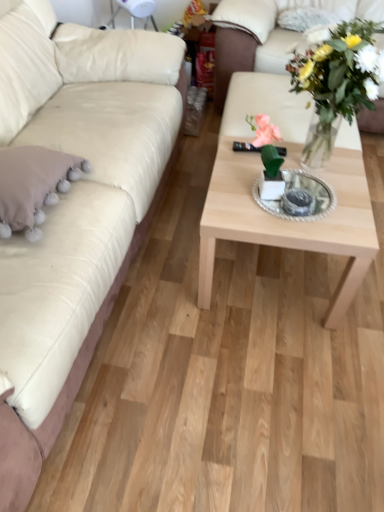
Question: From a real-world perspective, is matte white couch at left, the 2th studio couch when ordered from right to left, beneath beige fabric pillow at left, which appears as the 2th pillow when viewed from the back?

Choices:
 (A) yes
 (B) no

Answer: (A)

Question: Does matte white couch at left, the 2th studio couch when ordered from right to left, have a greater width compared to beige fabric pillow at left, the second pillow positioned from the top?

Choices:
 (A) no
 (B) yes

Answer: (B)

Question: Is matte white couch at left, which ranks as the first studio couch in left-to-right order, bigger than beige fabric pillow at left, the second pillow positioned from the top?

Choices:
 (A) yes
 (B) no

Answer: (A)

Question: Does matte white couch at left, the 2th studio couch when ordered from right to left, have a lesser height compared to beige fabric pillow at left, marked as the first pillow in a front-to-back arrangement?

Choices:
 (A) no
 (B) yes

Answer: (A)

Question: Is the depth of matte white couch at left, the 2th studio couch when ordered from right to left, greater than that of beige fabric pillow at left, which appears as the 2th pillow when viewed from the back?

Choices:
 (A) yes
 (B) no

Answer: (B)

Question: Visually, is matte white couch at left, which ranks as the first studio couch in left-to-right order, positioned to the left or to the right of fluffy white pillow at upper right, positioned as the 1th pillow in top-to-bottom order?

Choices:
 (A) left
 (B) right

Answer: (A)

Question: From a real-world perspective, is matte white couch at left, the 2th studio couch when ordered from right to left, physically located above or below fluffy white pillow at upper right, the 2th pillow when ordered from bottom to top?

Choices:
 (A) below
 (B) above

Answer: (A)

Question: From the image's perspective, is matte white couch at left, the 2th studio couch when ordered from right to left, above or below fluffy white pillow at upper right, the 2th pillow when ordered from bottom to top?

Choices:
 (A) above
 (B) below

Answer: (B)

Question: From their relative heights in the image, would you say matte white couch at left, the 2th studio couch when ordered from right to left, is taller or shorter than fluffy white pillow at upper right, positioned as the 1th pillow in top-to-bottom order?

Choices:
 (A) tall
 (B) short

Answer: (A)

Question: Looking at the image, does beige fabric pillow at left, marked as the first pillow in a front-to-back arrangement, seem bigger or smaller compared to white leather studio couch at upper right, which ranks as the second studio couch in left-to-right order?

Choices:
 (A) small
 (B) big

Answer: (A)

Question: From a real-world perspective, is beige fabric pillow at left, which appears as the 2th pillow when viewed from the back, physically located above or below white leather studio couch at upper right, the first studio couch in the right-to-left sequence?

Choices:
 (A) above
 (B) below

Answer: (A)

Question: Is point (72, 172) positioned closer to the camera than point (240, 26)?

Choices:
 (A) farther
 (B) closer

Answer: (B)

Question: Is beige fabric pillow at left, marked as the first pillow in a left-to-right arrangement, wider or thinner than white leather studio couch at upper right, which ranks as the second studio couch in left-to-right order?

Choices:
 (A) wide
 (B) thin

Answer: (B)

Question: In the image, is fluffy white pillow at upper right, marked as the first pillow in a right-to-left arrangement, positioned in front of or behind matte white couch at left, the 2th studio couch when ordered from right to left?

Choices:
 (A) front
 (B) behind

Answer: (B)

Question: Is fluffy white pillow at upper right, the 2th pillow when ordered from bottom to top, situated inside matte white couch at left, which ranks as the first studio couch in left-to-right order, or outside?

Choices:
 (A) outside
 (B) inside

Answer: (A)